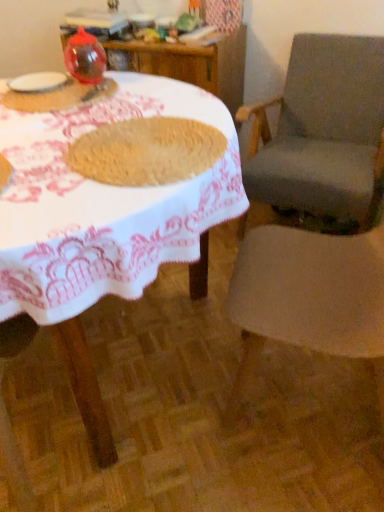
Locate an element on the screen. Image resolution: width=384 pixels, height=512 pixels. free space to the left of gray fabric chair at right, the 2th chair when ordered from back to front is located at coordinates (178, 397).